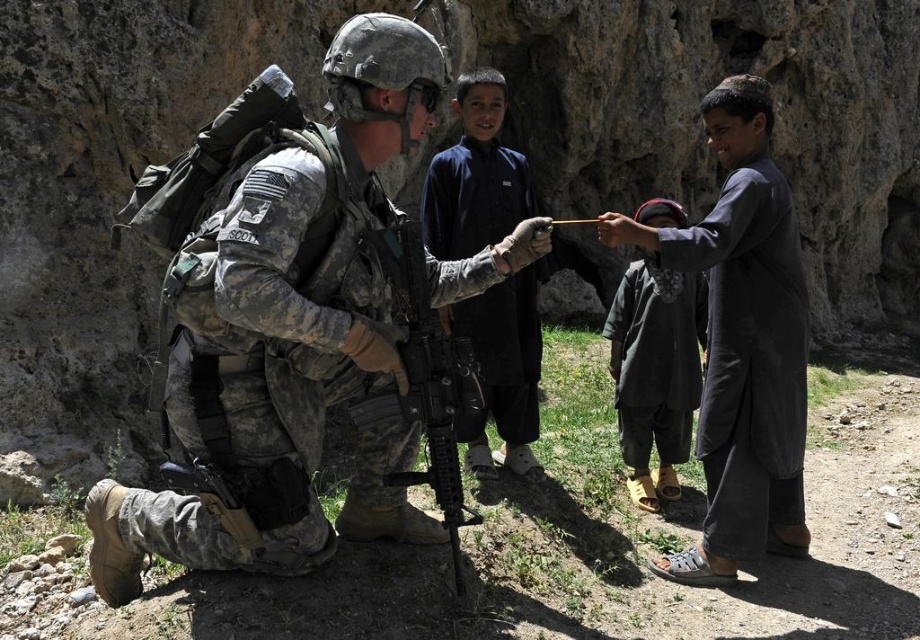
You are a photographer trying to capture a clear shot of the matte black rifle at center without the camouflage uniform at center blocking it. Is the rifle currently visible in this scene?

The camouflage uniform at center is positioned over matte black rifle at center, so the rifle is partially or fully blocked and not fully visible.

Based on the photo, you are a drone operator analyzing the image. You need to report the exact 2D coordinates of the dark gray fabric at right to your team. What are its coordinates?

The dark gray fabric at right is located at coordinates point (742, 342).